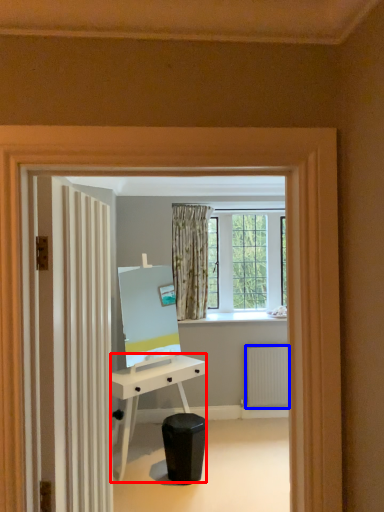
Question: Which object appears closest to the camera in this image, desk (highlighted by a red box) or radiator (highlighted by a blue box)?

Choices:
 (A) desk
 (B) radiator

Answer: (A)